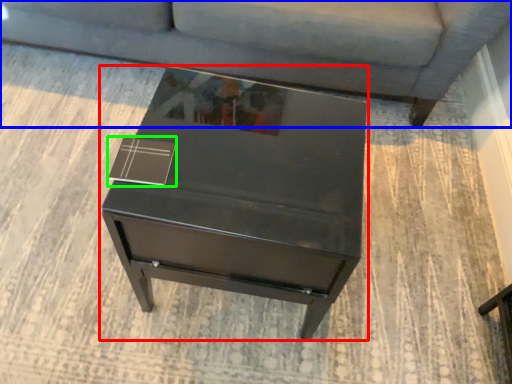
Question: Which object is positioned farthest from table (highlighted by a red box)? Select from studio couch (highlighted by a blue box) and square (highlighted by a green box).

Choices:
 (A) studio couch
 (B) square

Answer: (A)